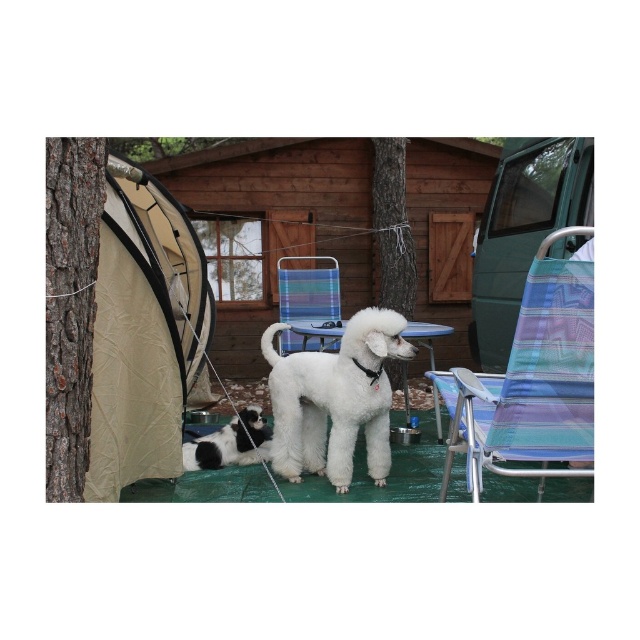
Question: Is black-and-white fur at lower center below blue striped picnic table at center?

Choices:
 (A) no
 (B) yes

Answer: (B)

Question: Which of the following is the closest to the observer?

Choices:
 (A) (221, 140)
 (B) (60, 492)

Answer: (B)

Question: Which object appears closest to the camera in this image?

Choices:
 (A) black-and-white fur at lower center
 (B) wooden cabin at center

Answer: (A)

Question: Which point is farther to the camera?

Choices:
 (A) beige fabric tent at left
 (B) brown rough tree trunk at center
 (C) brown rough tree trunk at left

Answer: (B)

Question: In this image, where is beige fabric tent at left located relative to multicolored fabric chair at center?

Choices:
 (A) left
 (B) right

Answer: (A)

Question: Does beige fabric tent at left have a smaller size compared to blue striped picnic table at center?

Choices:
 (A) yes
 (B) no

Answer: (B)